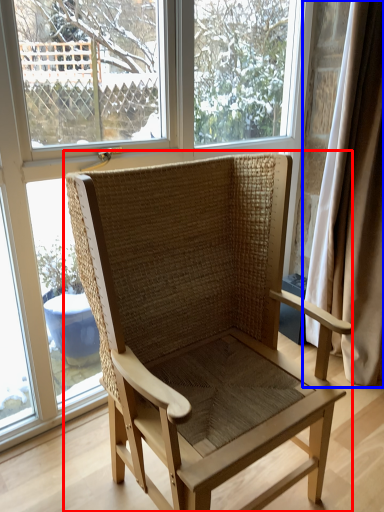
Question: Which object is further to the camera taking this photo, chair (highlighted by a red box) or curtain (highlighted by a blue box)?

Choices:
 (A) chair
 (B) curtain

Answer: (B)